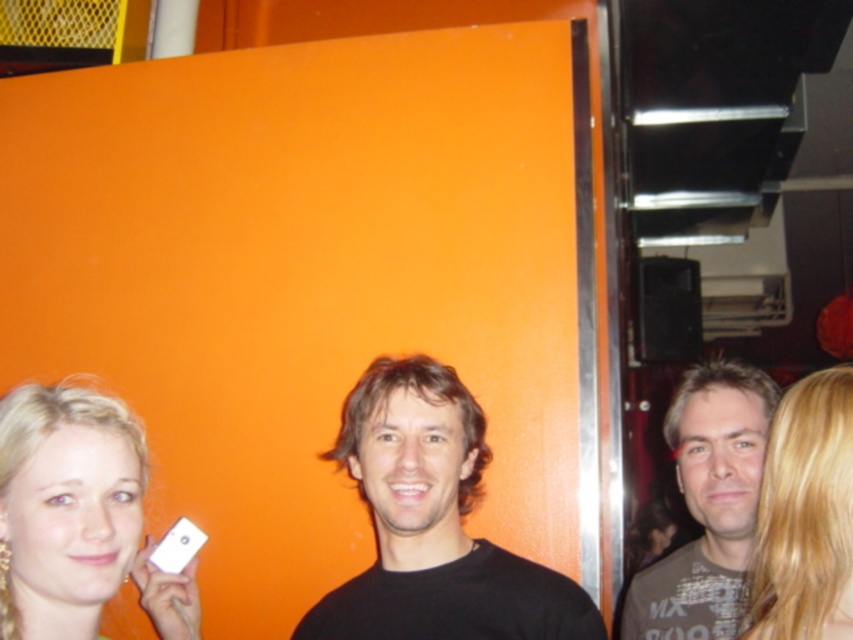
Measure the distance between black matte shirt at center and gray printed t-shirt at right.

black matte shirt at center and gray printed t-shirt at right are 15.31 inches apart from each other.

Between black matte shirt at center and gray printed t-shirt at right, which one appears on the right side from the viewer's perspective?

gray printed t-shirt at right

This screenshot has width=853, height=640. In order to click on black matte shirt at center in this screenshot , I will do `click(433, 524)`.

Based on the photo, which of these two, black matte shirt at center or matte white phone at lower left, stands shorter?

With less height is matte white phone at lower left.

Between point (457, 432) and point (192, 596), which one is positioned behind?

Positioned behind is point (192, 596).

This screenshot has width=853, height=640. What do you see at coordinates (433, 524) in the screenshot?
I see `black matte shirt at center` at bounding box center [433, 524].

Image resolution: width=853 pixels, height=640 pixels. In order to click on black matte shirt at center in this screenshot , I will do `click(433, 524)`.

Which of these two, gray printed t-shirt at right or blonde hair at right, stands taller?

gray printed t-shirt at right is taller.

Is point (693, 458) behind point (776, 584)?

Yes, point (693, 458) is behind point (776, 584).

You are a GUI agent. You are given a task and a screenshot of the screen. Output one action in this format:
    pyautogui.click(x=<x>, y=<y>)
    Task: Click on the gray printed t-shirt at right
    
    Given the screenshot: What is the action you would take?
    pyautogui.click(x=706, y=504)